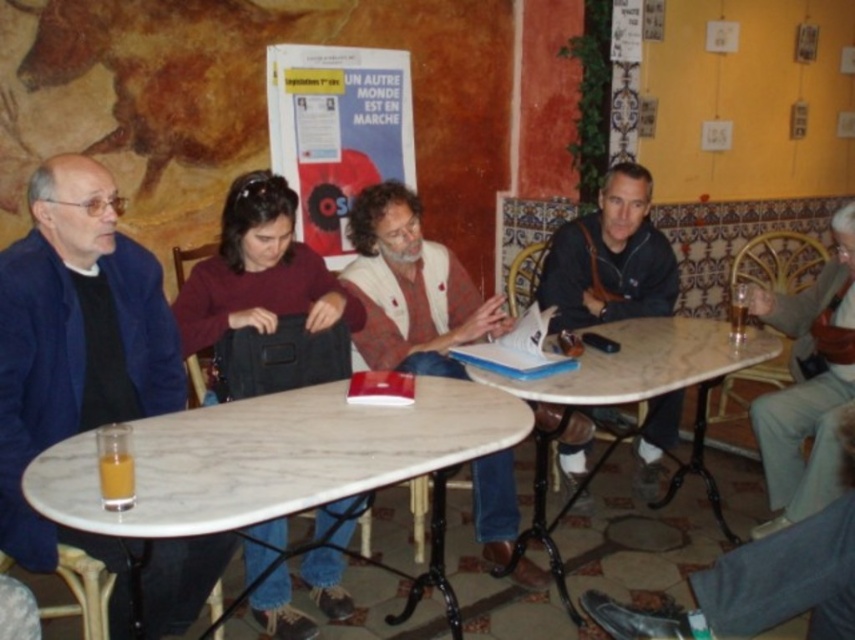
Question: Where is leather jacket at center located in relation to translucent glass beverage at table right in the image?

Choices:
 (A) left
 (B) right

Answer: (A)

Question: Which of the following is the farthest from the observer?

Choices:
 (A) (733, 304)
 (B) (349, 259)
 (C) (614, 280)
 (D) (423, 392)

Answer: (B)

Question: Can you confirm if leather jacket at center is positioned above translucent glass beverage at table left?

Choices:
 (A) no
 (B) yes

Answer: (B)

Question: Which point is farther to the camera?

Choices:
 (A) (771, 531)
 (B) (623, 282)
 (C) (151, 426)
 (D) (476, 506)

Answer: (B)

Question: Does blue woolen jacket at left have a lesser width compared to dark red sweater at center?

Choices:
 (A) no
 (B) yes

Answer: (B)

Question: Which point is farther from the camera taking this photo?

Choices:
 (A) (628, 380)
 (B) (762, 300)

Answer: (B)